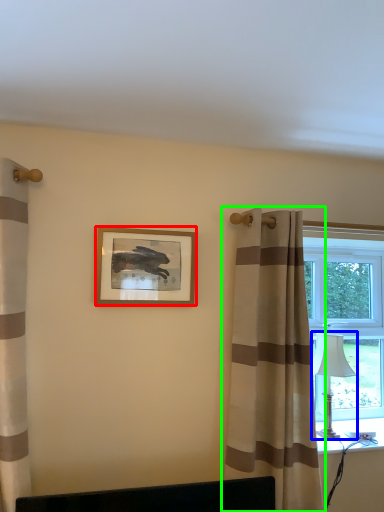
Question: Considering the real-world distances, which object is closest to picture frame (highlighted by a red box)? table lamp (highlighted by a blue box) or curtain (highlighted by a green box).

Choices:
 (A) table lamp
 (B) curtain

Answer: (B)